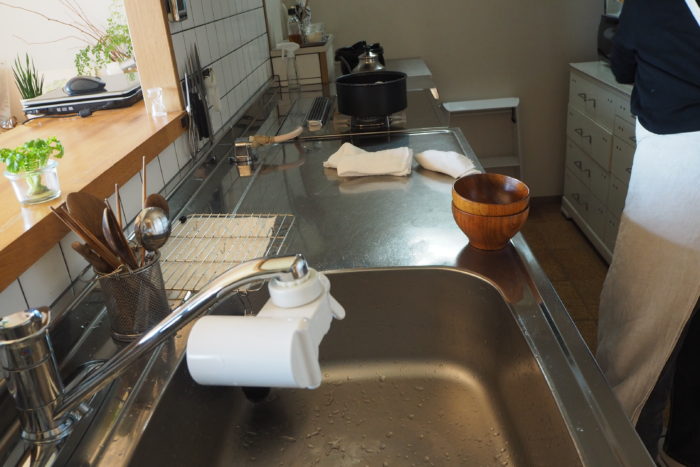
At what (x,y) coordinates should I click in order to perform the action: click on cooking pot. Please return your answer as a coordinate pair (x, y). The width and height of the screenshot is (700, 467). Looking at the image, I should click on (372, 103).